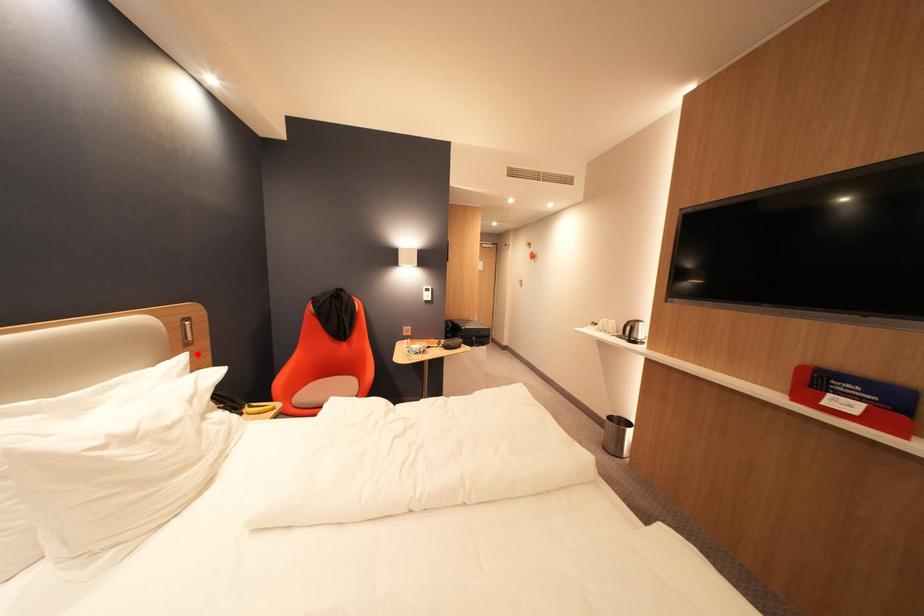
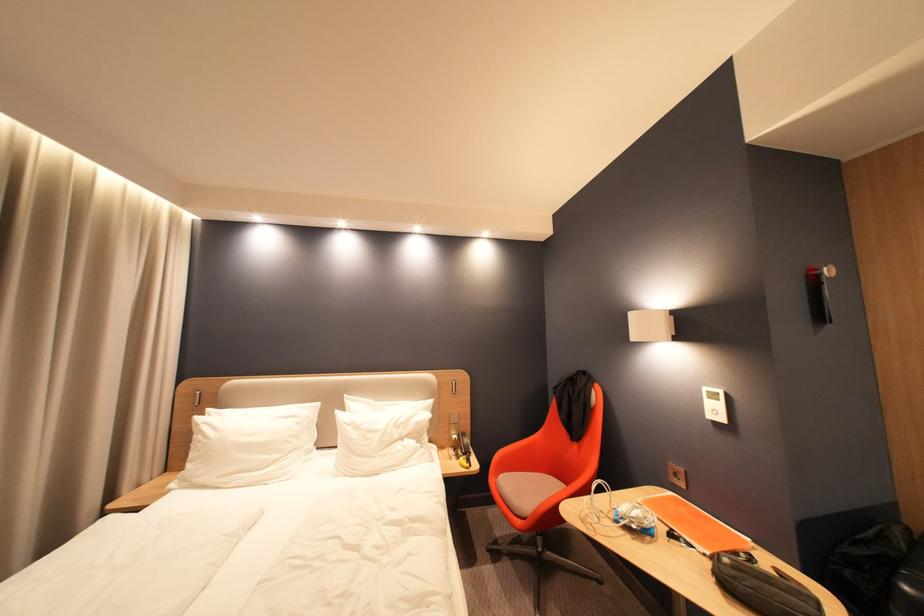
Question: I am providing you with two images of the same scene from different viewpoints. In image1, a red point is highlighted. Considering the same 3D point in image2, which of the following is correct?

Choices:
 (A) It is closer
 (B) It is farther

Answer: (B)